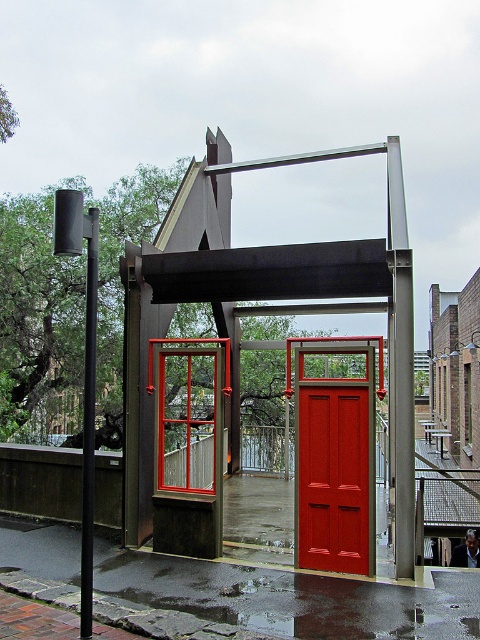
Question: From the image, what is the correct spatial relationship of metallic red door at center in relation to black metal pole at left?

Choices:
 (A) above
 (B) below

Answer: (A)

Question: Which of the following is the farthest from the observer?

Choices:
 (A) (316, 544)
 (B) (184, 198)
 (C) (88, 584)

Answer: (B)

Question: Considering the relative positions of metallic red door at center and matte red door at center in the image provided, where is metallic red door at center located with respect to matte red door at center?

Choices:
 (A) right
 (B) left

Answer: (B)

Question: Which object is closer to the camera taking this photo?

Choices:
 (A) matte red door at center
 (B) black metal pole at left

Answer: (B)

Question: Is the position of metallic red door at center more distant than that of black metal pole at left?

Choices:
 (A) no
 (B) yes

Answer: (B)

Question: Which of the following is the farthest from the observer?

Choices:
 (A) black metal pole at left
 (B) metallic red door at center
 (C) matte red door at center

Answer: (B)